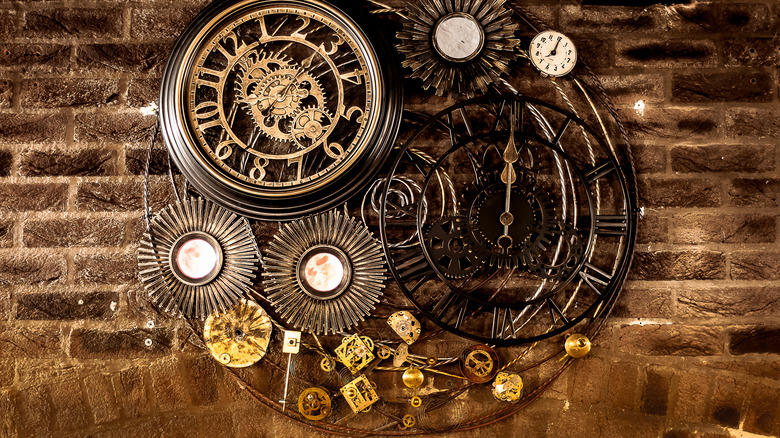
Find the location of a particular element. various gears and clock parts used as decoration is located at coordinates (505, 388), (481, 373), (406, 327), (356, 340), (360, 398), (317, 403), (413, 381), (331, 359), (410, 405), (413, 422).